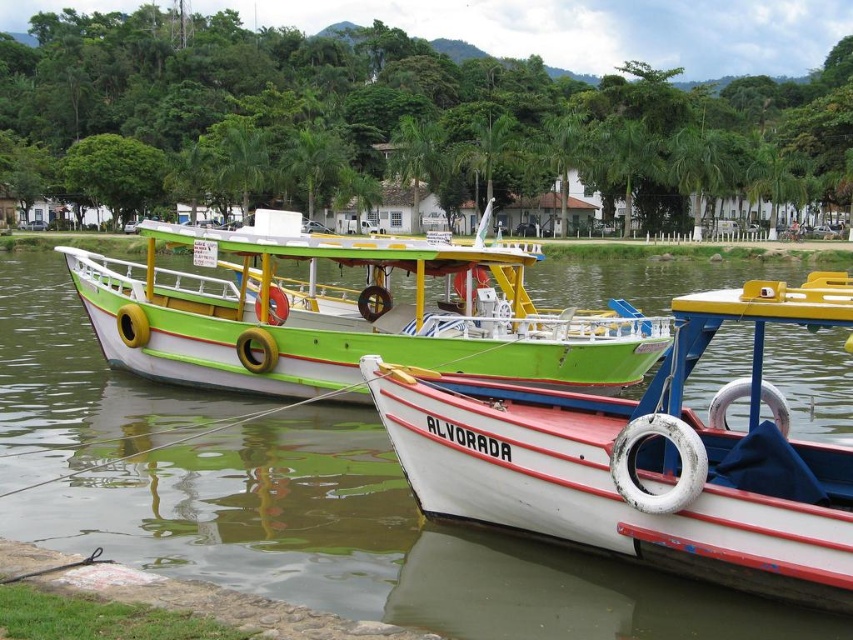
Is point (415, 420) closer to viewer compared to point (152, 243)?

Yes, it is in front of point (152, 243).

Is white matte boat at lower right taller than green matte boat at center?

Incorrect, white matte boat at lower right's height is not larger of green matte boat at center's.

Describe the element at coordinates (643, 458) in the screenshot. This screenshot has width=853, height=640. I see `white matte boat at lower right` at that location.

This screenshot has height=640, width=853. Find the location of `white matte boat at lower right`. white matte boat at lower right is located at coordinates (643, 458).